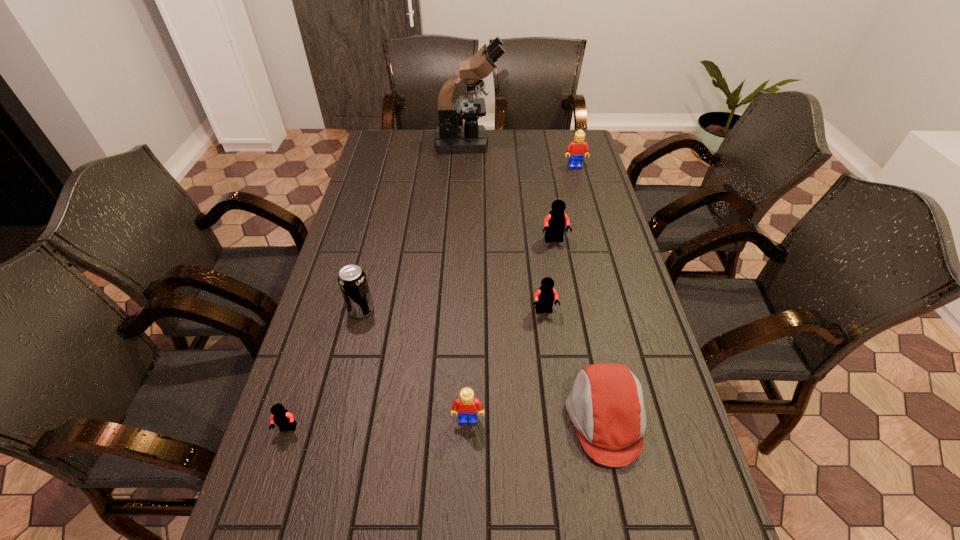
Image resolution: width=960 pixels, height=540 pixels. What are the coordinates of `vacant space located 0.120m on the front-facing side of the red cap` in the screenshot? It's located at (514, 418).

Find the location of `vacant region located on the front-facing side of the red cap`. vacant region located on the front-facing side of the red cap is located at coordinates (399, 418).

The width and height of the screenshot is (960, 540). I want to click on free space located on the front-facing side of the red cap, so click(418, 418).

Where is `blank space located on the front-facing side of the smallest black Lego`? blank space located on the front-facing side of the smallest black Lego is located at coordinates (268, 494).

This screenshot has width=960, height=540. In order to click on object present at the far edge in this screenshot , I will do `click(451, 137)`.

Find the location of a particular element. The image size is (960, 540). soda can that is at the left edge is located at coordinates (352, 280).

At what (x,y) coordinates should I click in order to perform the action: click on Lego positioned at the left edge. Please return your answer as a coordinate pair (x, y). This screenshot has width=960, height=540. Looking at the image, I should click on (280, 416).

In order to click on cap that is at the right edge in this screenshot , I will do `click(606, 406)`.

I want to click on free location at the far edge of the desktop, so click(494, 140).

In the image, there is a desktop. Where is `vacant space at the left edge`? This screenshot has height=540, width=960. vacant space at the left edge is located at coordinates (294, 388).